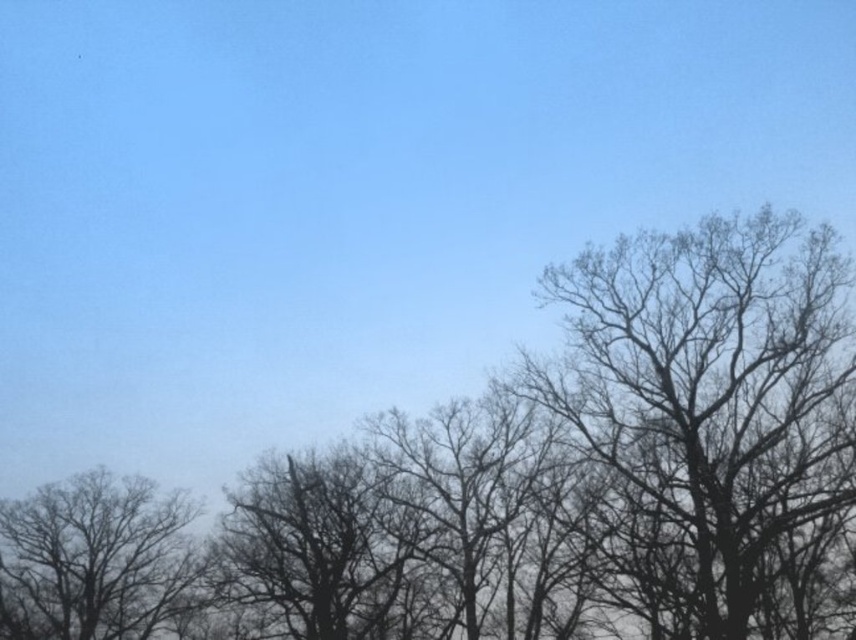
Does bare branches at right come in front of silhouette bare tree at left?

Yes, it is in front of silhouette bare tree at left.

Who is more distant from viewer, (691, 417) or (177, 592)?

Point (177, 592)

Is point (728, 352) positioned in front of point (33, 554)?

Yes, point (728, 352) is in front of point (33, 554).

Locate an element on the screen. bare branches at right is located at coordinates (706, 410).